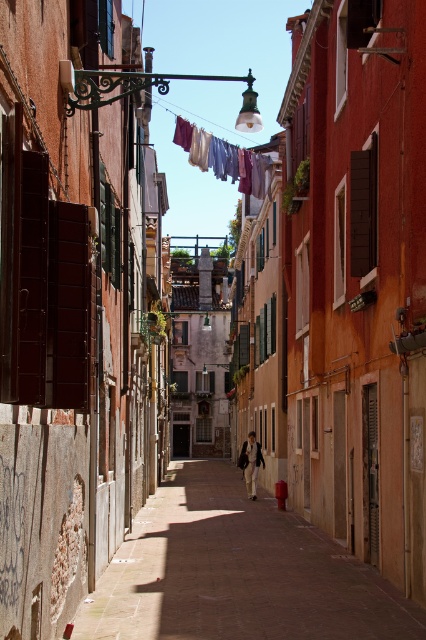
Does multicolored fabric at center appear on the right side of light beige fabric jacket at center?

No, multicolored fabric at center is not to the right of light beige fabric jacket at center.

Image resolution: width=426 pixels, height=640 pixels. Find the location of `multicolored fabric at center`. multicolored fabric at center is located at coordinates (222, 157).

Which is behind, point (224, 170) or point (253, 497)?

The point (224, 170) is behind.

At what (x,y) coordinates should I click in order to perform the action: click on multicolored fabric at center. Please return your answer as a coordinate pair (x, y). Looking at the image, I should click on (222, 157).

Is smooth stone alley at center shorter than multicolored fabric at center?

Indeed, smooth stone alley at center has a lesser height compared to multicolored fabric at center.

Is smooth stone alley at center smaller than multicolored fabric at center?

Yes, smooth stone alley at center is smaller than multicolored fabric at center.

The width and height of the screenshot is (426, 640). Find the location of `smooth stone alley at center`. smooth stone alley at center is located at coordinates (236, 572).

Can you confirm if smooth stone alley at center is positioned to the left of light beige fabric jacket at center?

Correct, you'll find smooth stone alley at center to the left of light beige fabric jacket at center.

Can you confirm if smooth stone alley at center is taller than light beige fabric jacket at center?

In fact, smooth stone alley at center may be shorter than light beige fabric jacket at center.

Who is more forward, (299, 624) or (253, 497)?

Point (299, 624) is more forward.

Identify the location of smooth stone alley at center. This screenshot has height=640, width=426. coord(236,572).